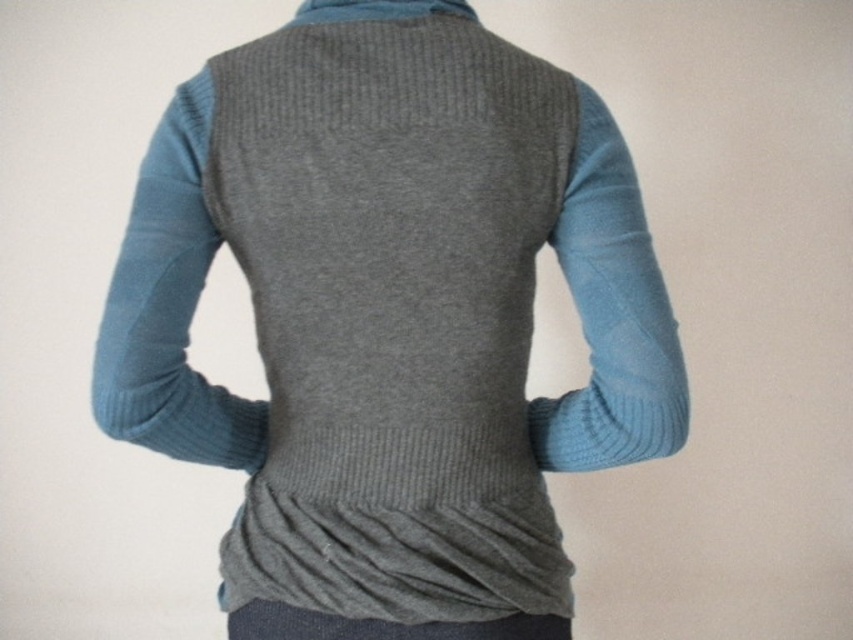
Question: Which is farther from the teal ribbed sweater sleeve at left?

Choices:
 (A) knitted gray cardigan at center
 (B) light blue ribbed sweater sleeve at right
 (C) matte gray pocket at lower center

Answer: (B)

Question: Where is matte gray pocket at lower center located in relation to teal ribbed sweater sleeve at left in the image?

Choices:
 (A) right
 (B) left

Answer: (A)

Question: Which of the following is the closest to the observer?

Choices:
 (A) (445, 525)
 (B) (614, 157)
 (C) (140, 314)

Answer: (C)

Question: Can you confirm if teal ribbed sweater sleeve at left is positioned to the left of light blue ribbed sweater sleeve at right?

Choices:
 (A) yes
 (B) no

Answer: (A)

Question: Considering the relative positions of matte gray pocket at lower center and light blue ribbed sweater sleeve at right in the image provided, where is matte gray pocket at lower center located with respect to light blue ribbed sweater sleeve at right?

Choices:
 (A) below
 (B) above

Answer: (A)

Question: Which of the following is the closest to the observer?

Choices:
 (A) (556, 412)
 (B) (357, 576)
 (C) (187, 193)

Answer: (B)